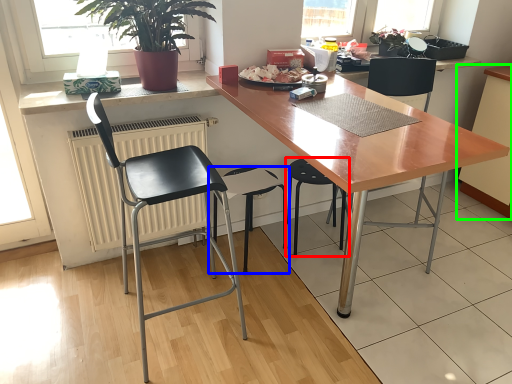
Question: Which is nearer to the chair (highlighted by a red box)? chair (highlighted by a blue box) or cabinetry (highlighted by a green box).

Choices:
 (A) chair
 (B) cabinetry

Answer: (A)